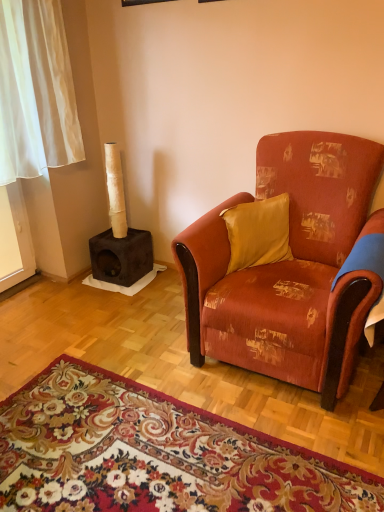
Question: Should I look upward or downward to see textured orange fabric armchair at center?

Choices:
 (A) up
 (B) down

Answer: (A)

Question: Is satin yellow pillow at center further to the viewer compared to floral carpet at lower center?

Choices:
 (A) yes
 (B) no

Answer: (A)

Question: Can you confirm if satin yellow pillow at center is thinner than floral carpet at lower center?

Choices:
 (A) no
 (B) yes

Answer: (B)

Question: Could you tell me if satin yellow pillow at center is facing floral carpet at lower center?

Choices:
 (A) no
 (B) yes

Answer: (A)

Question: Could floral carpet at lower center be considered to be inside satin yellow pillow at center?

Choices:
 (A) yes
 (B) no

Answer: (B)

Question: From the image's perspective, would you say satin yellow pillow at center is positioned over floral carpet at lower center?

Choices:
 (A) yes
 (B) no

Answer: (A)

Question: Does satin yellow pillow at center appear on the right side of floral carpet at lower center?

Choices:
 (A) yes
 (B) no

Answer: (A)

Question: Is textured orange fabric armchair at center at the back of dark brown suede cat tree at left?

Choices:
 (A) no
 (B) yes

Answer: (A)

Question: Is dark brown suede cat tree at left with textured orange fabric armchair at center?

Choices:
 (A) no
 (B) yes

Answer: (A)

Question: Would you say textured orange fabric armchair at center is part of dark brown suede cat tree at left's contents?

Choices:
 (A) no
 (B) yes

Answer: (A)

Question: From the image's perspective, is dark brown suede cat tree at left above textured orange fabric armchair at center?

Choices:
 (A) yes
 (B) no

Answer: (A)

Question: Can you confirm if dark brown suede cat tree at left is taller than textured orange fabric armchair at center?

Choices:
 (A) yes
 (B) no

Answer: (B)

Question: Can we say dark brown suede cat tree at left lies outside textured orange fabric armchair at center?

Choices:
 (A) yes
 (B) no

Answer: (A)

Question: Is dark brown suede cat tree at left inside textured orange fabric armchair at center?

Choices:
 (A) no
 (B) yes

Answer: (A)